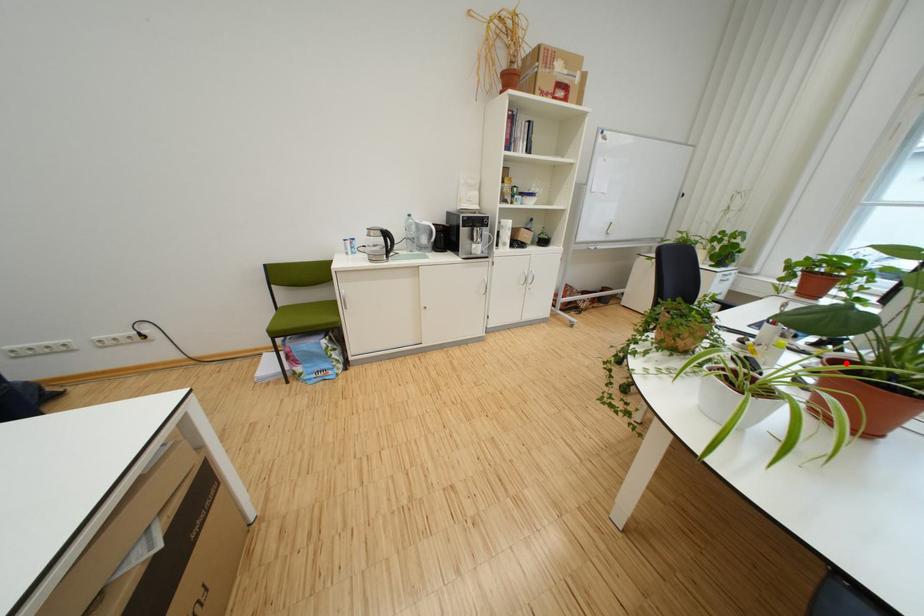
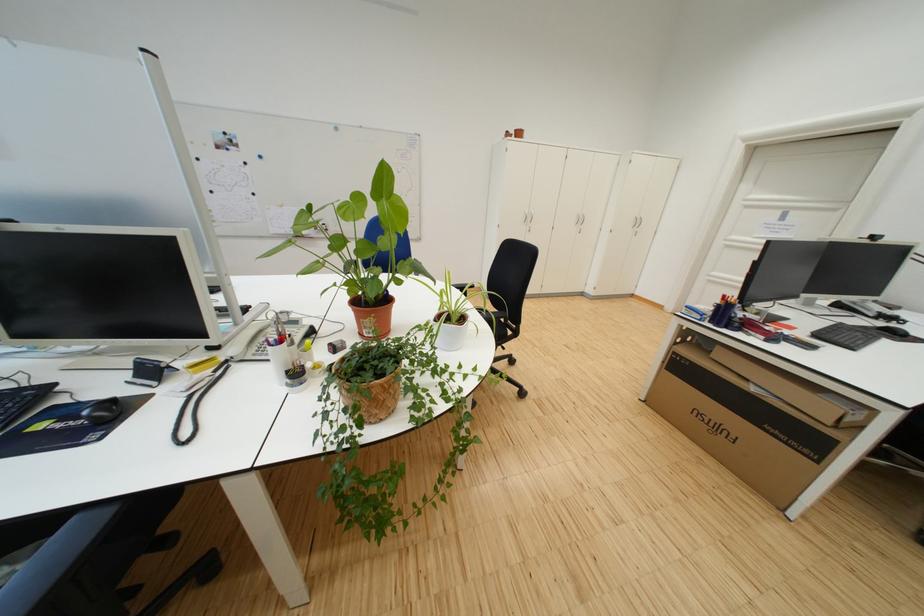
Question: I am providing you with two images of the same scene from different viewpoints. A red point is marked on the first image. At the location where the point appears in image 1, is it still visible in image 2?

Choices:
 (A) Yes
 (B) No

Answer: (B)